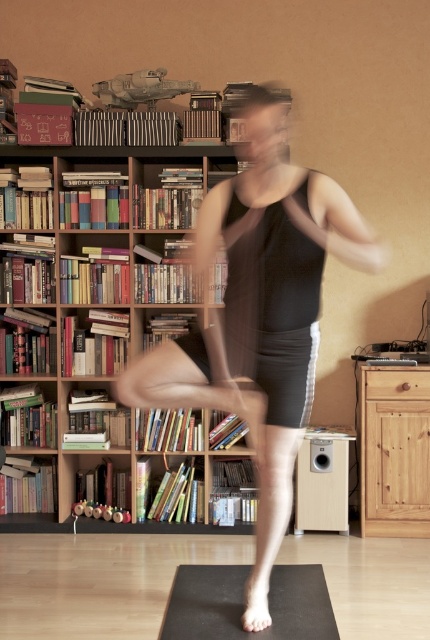
Looking at this image, you are trying to place a decorative item that is 1 meter wide on the wooden bookcase at left or the black matte tank top at center. Which surface can accommodate it?

The wooden bookcase at left might be wider than black matte tank top at center, so it is more likely to accommodate the 1 meter wide decorative item.

You are a photographer trying to capture a clear shot of the black matte tank top at center without the wooden bookcase at left appearing in the background. Is this possible given their positions?

The wooden bookcase at left is above the black matte tank top at center, so adjusting the camera angle downward might allow you to frame the shot so the wooden bookcase at left is out of view while keeping the black matte tank top at center in focus.